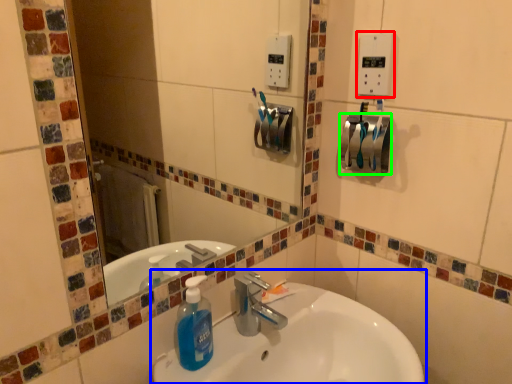
Question: Estimate the real-world distances between objects in this image. Which object is farther from light switch (highlighted by a red box), sink (highlighted by a blue box) or towel bar (highlighted by a green box)?

Choices:
 (A) sink
 (B) towel bar

Answer: (A)